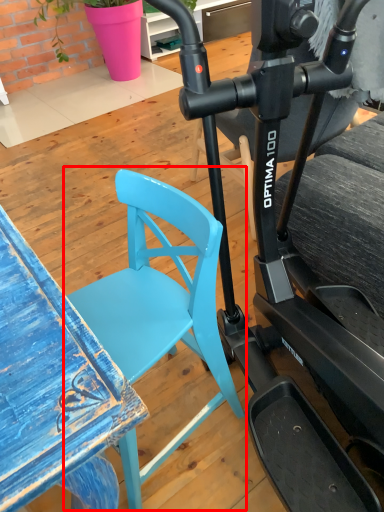
Question: From the image, what is the correct spatial relationship of chair (annotated by the red box) in relation to stationary bicycle?

Choices:
 (A) right
 (B) left

Answer: (B)